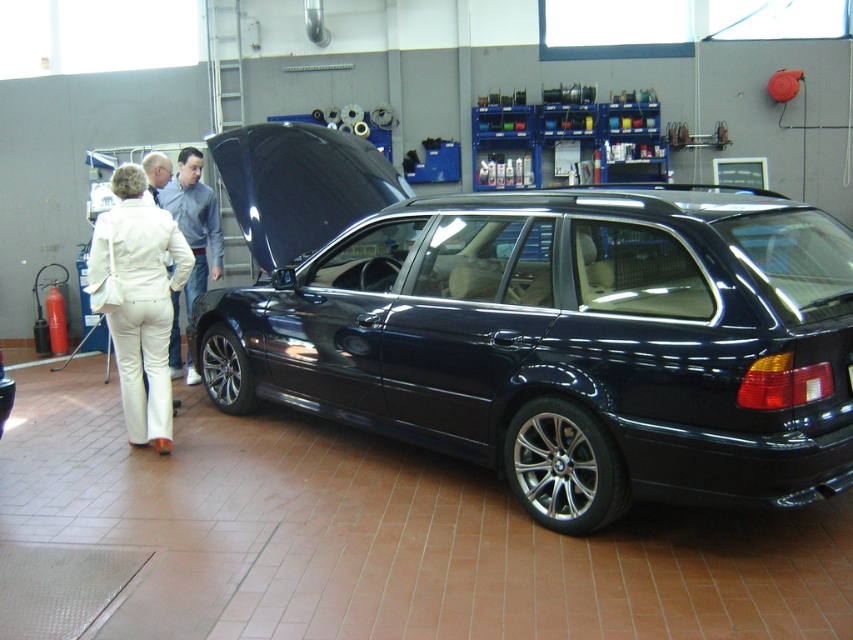
Question: Can you confirm if white fabric pants at left is positioned to the left of blue fabric shirt at center?

Choices:
 (A) no
 (B) yes

Answer: (A)

Question: Among these points, which one is farthest from the camera?

Choices:
 (A) (160, 236)
 (B) (701, 474)
 (C) (186, 314)

Answer: (C)

Question: Which point is farther from the camera taking this photo?

Choices:
 (A) (799, 330)
 (B) (190, 161)
 (C) (140, 202)

Answer: (B)

Question: Is white fabric pants at left bigger than blue fabric shirt at center?

Choices:
 (A) yes
 (B) no

Answer: (B)

Question: Does glossy black car at center have a greater width compared to white fabric pants at left?

Choices:
 (A) no
 (B) yes

Answer: (B)

Question: Which point is closer to the camera?

Choices:
 (A) white fabric pants at left
 (B) glossy black car at center

Answer: (B)